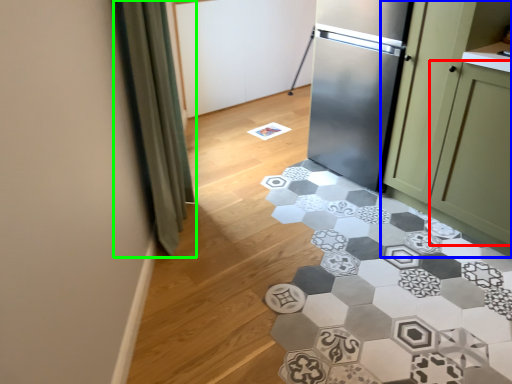
Question: Based on their relative distances, which object is farther from glass door (highlighted by a red box)? Choose from cabinetry (highlighted by a blue box) and curtain (highlighted by a green box).

Choices:
 (A) cabinetry
 (B) curtain

Answer: (B)